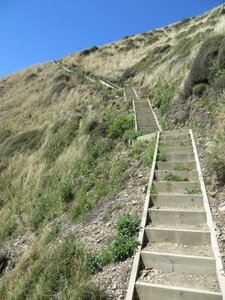
The height and width of the screenshot is (300, 225). In order to click on the 3rd stair in this screenshot , I will do `click(190, 228)`.